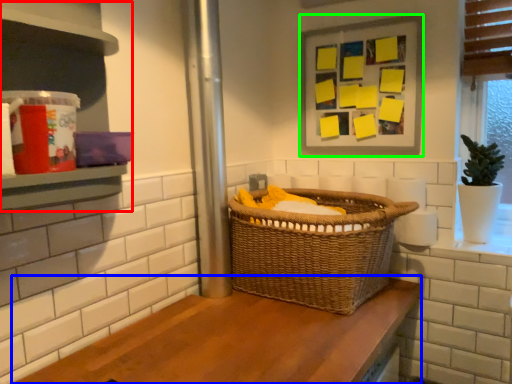
Question: Estimate the real-world distances between objects in this image. Which object is closer to shelf (highlighted by a red box), counter (highlighted by a blue box) or picture frame (highlighted by a green box)?

Choices:
 (A) counter
 (B) picture frame

Answer: (A)